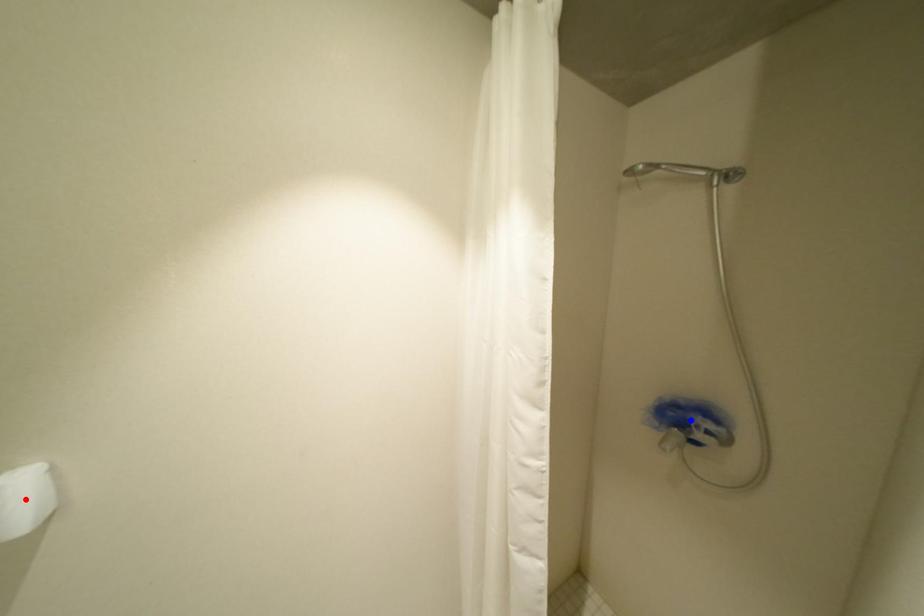
Question: Two points are marked on the image. Which point is closer to the camera?

Choices:
 (A) Blue point is closer.
 (B) Red point is closer.

Answer: (B)